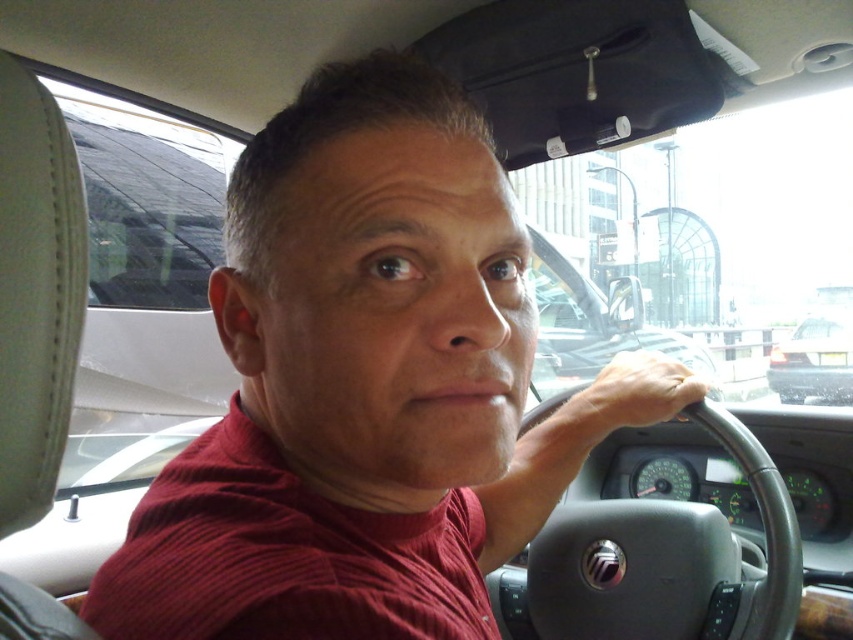
Measure the distance between black leather steering wheel at center and camera.

37.06 inches

Is black leather steering wheel at center closer to camera compared to matte black sedan at right?

Yes, black leather steering wheel at center is in front of matte black sedan at right.

Between point (541, 602) and point (799, 348), which one is positioned behind?

The point (799, 348) is behind.

In order to click on black leather steering wheel at center in this screenshot , I will do `click(668, 561)`.

Which is in front, point (639, 362) or point (770, 376)?

Positioned in front is point (639, 362).

Is point (631, 417) positioned before point (824, 394)?

Yes, point (631, 417) is in front of point (824, 394).

Who is more distant from viewer, [613,387] or [801,326]?

The point [801,326] is behind.

Where is `smooth skin hand at steering wheel`? The width and height of the screenshot is (853, 640). smooth skin hand at steering wheel is located at coordinates (635, 392).

How much distance is there between black leather steering wheel at center and smooth skin hand at steering wheel?

They are 11.06 inches apart.

Find the location of a particular element. black leather steering wheel at center is located at coordinates (668, 561).

What are the coordinates of `black leather steering wheel at center` in the screenshot? It's located at (668, 561).